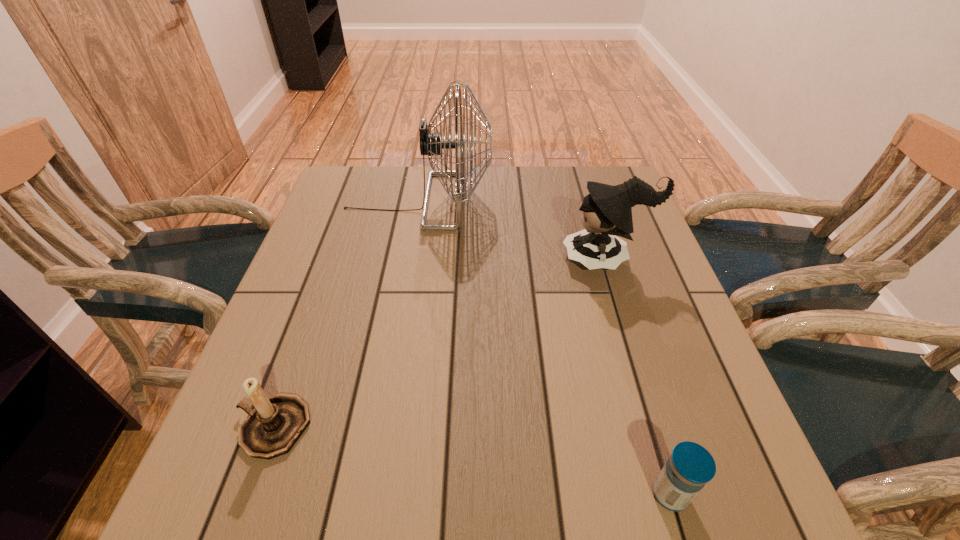
At what (x,y) coordinates should I click in order to perform the action: click on free space that is in between the fan and the doll. Please return your answer as a coordinate pair (x, y). This screenshot has width=960, height=540. Looking at the image, I should click on (513, 230).

At what (x,y) coordinates should I click in order to perform the action: click on free point between the second tallest object and the medicine. Please return your answer as a coordinate pair (x, y). Looking at the image, I should click on (638, 377).

Locate an element on the screen. The image size is (960, 540). empty location between the fan and the second nearest object is located at coordinates (346, 314).

Identify the location of free space between the second tallest object and the second nearest object. (440, 343).

Locate an element on the screen. unoccupied area between the candle holder and the tallest object is located at coordinates (346, 314).

Image resolution: width=960 pixels, height=540 pixels. Find the location of `vacant area between the medicine and the third farthest object`. vacant area between the medicine and the third farthest object is located at coordinates (471, 461).

Image resolution: width=960 pixels, height=540 pixels. What are the coordinates of `vacant region between the farthest object and the second farthest object` in the screenshot? It's located at (513, 230).

Locate which object ranks in proximity to the nearest object. Please provide its 2D coordinates. Your answer should be formatted as a tuple, i.e. [(x, y)], where the tuple contains the x and y coordinates of a point satisfying the conditions above.

[(607, 211)]

Locate which object ranks third in proximity to the tallest object. Please provide its 2D coordinates. Your answer should be formatted as a tuple, i.e. [(x, y)], where the tuple contains the x and y coordinates of a point satisfying the conditions above.

[(690, 466)]

At what (x,y) coordinates should I click in order to perform the action: click on free region that satisfies the following two spatial constraints: 1. on the front-facing side of the farthest object; 2. on the back side of the medicine. Please return your answer as a coordinate pair (x, y). The height and width of the screenshot is (540, 960). Looking at the image, I should click on (367, 494).